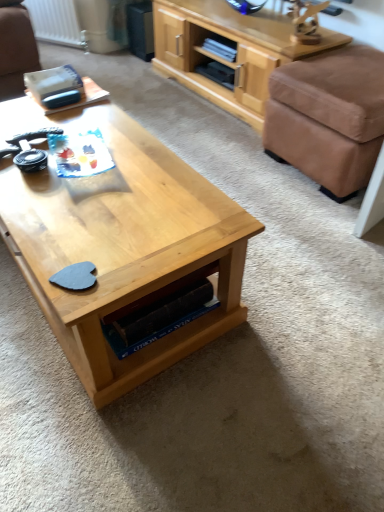
Question: From a real-world perspective, does light wood coffee table at center stand above brown fabric ottoman at right?

Choices:
 (A) yes
 (B) no

Answer: (B)

Question: From a real-world perspective, is light wood coffee table at center positioned under brown fabric ottoman at right based on gravity?

Choices:
 (A) yes
 (B) no

Answer: (A)

Question: Are light wood coffee table at center and brown fabric ottoman at right located far from each other?

Choices:
 (A) no
 (B) yes

Answer: (A)

Question: Is light wood coffee table at center thinner than brown fabric ottoman at right?

Choices:
 (A) no
 (B) yes

Answer: (B)

Question: Is light wood coffee table at center further to the viewer compared to brown fabric ottoman at right?

Choices:
 (A) yes
 (B) no

Answer: (B)

Question: Are light wood coffee table at center and brown fabric ottoman at right beside each other?

Choices:
 (A) no
 (B) yes

Answer: (A)

Question: Is brown fabric ottoman at right bigger than light wood coffee table at center?

Choices:
 (A) no
 (B) yes

Answer: (A)

Question: Is the depth of brown fabric ottoman at right less than that of light wood coffee table at center?

Choices:
 (A) no
 (B) yes

Answer: (A)

Question: From a real-world perspective, is brown fabric ottoman at right over light wood coffee table at center?

Choices:
 (A) no
 (B) yes

Answer: (B)

Question: Can you confirm if brown fabric ottoman at right is thinner than light wood coffee table at center?

Choices:
 (A) yes
 (B) no

Answer: (B)

Question: Is brown fabric ottoman at right to the right of light wood coffee table at center from the viewer's perspective?

Choices:
 (A) no
 (B) yes

Answer: (B)

Question: Is brown fabric ottoman at right not near light wood coffee table at center?

Choices:
 (A) yes
 (B) no

Answer: (B)

Question: Considering the relative positions of light wood cabinet at upper right and brown fabric ottoman at right in the image provided, is light wood cabinet at upper right to the left of brown fabric ottoman at right from the viewer's perspective?

Choices:
 (A) no
 (B) yes

Answer: (B)